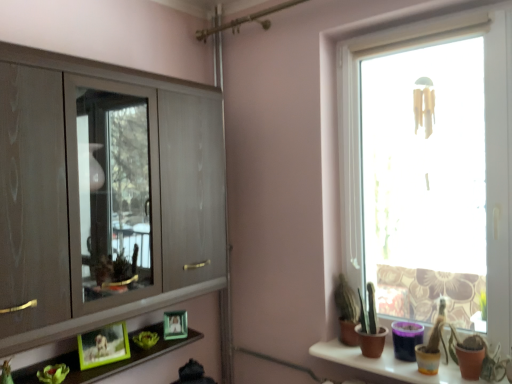
Question: Is matte wood cupboard at left thinner than green matte plant at lower left?

Choices:
 (A) yes
 (B) no

Answer: (B)

Question: Is matte wood cupboard at left placed right next to green matte plant at lower left?

Choices:
 (A) yes
 (B) no

Answer: (B)

Question: Is the position of matte wood cupboard at left more distant than that of green matte plant at lower left?

Choices:
 (A) yes
 (B) no

Answer: (B)

Question: Is matte wood cupboard at left closer to the viewer compared to green matte plant at lower left?

Choices:
 (A) no
 (B) yes

Answer: (B)

Question: Would you consider matte wood cupboard at left to be distant from green matte plant at lower left?

Choices:
 (A) yes
 (B) no

Answer: (B)

Question: Considering the positions of point (434, 36) and point (64, 377), is point (434, 36) closer or farther from the camera than point (64, 377)?

Choices:
 (A) closer
 (B) farther

Answer: (B)

Question: From the image's perspective, is transparent glass window at right positioned above or below green matte plant at lower left?

Choices:
 (A) above
 (B) below

Answer: (A)

Question: Looking at the image, does transparent glass window at right seem bigger or smaller compared to green matte plant at lower left?

Choices:
 (A) small
 (B) big

Answer: (B)

Question: From a real-world perspective, is transparent glass window at right positioned above or below green matte plant at lower left?

Choices:
 (A) above
 (B) below

Answer: (A)

Question: Considering the positions of point (393, 352) and point (46, 374), is point (393, 352) closer or farther from the camera than point (46, 374)?

Choices:
 (A) closer
 (B) farther

Answer: (B)

Question: Is terracotta clay pots at lower right taller or shorter than green matte plant at lower left?

Choices:
 (A) short
 (B) tall

Answer: (A)

Question: Is terracotta clay pots at lower right bigger or smaller than green matte plant at lower left?

Choices:
 (A) small
 (B) big

Answer: (B)

Question: Is terracotta clay pots at lower right in front of or behind green matte plant at lower left in the image?

Choices:
 (A) front
 (B) behind

Answer: (A)

Question: Considering their positions, is transparent glass window at right located in front of or behind terracotta clay pots at lower right?

Choices:
 (A) behind
 (B) front

Answer: (A)

Question: From a real-world perspective, is transparent glass window at right physically located above or below terracotta clay pots at lower right?

Choices:
 (A) above
 (B) below

Answer: (A)